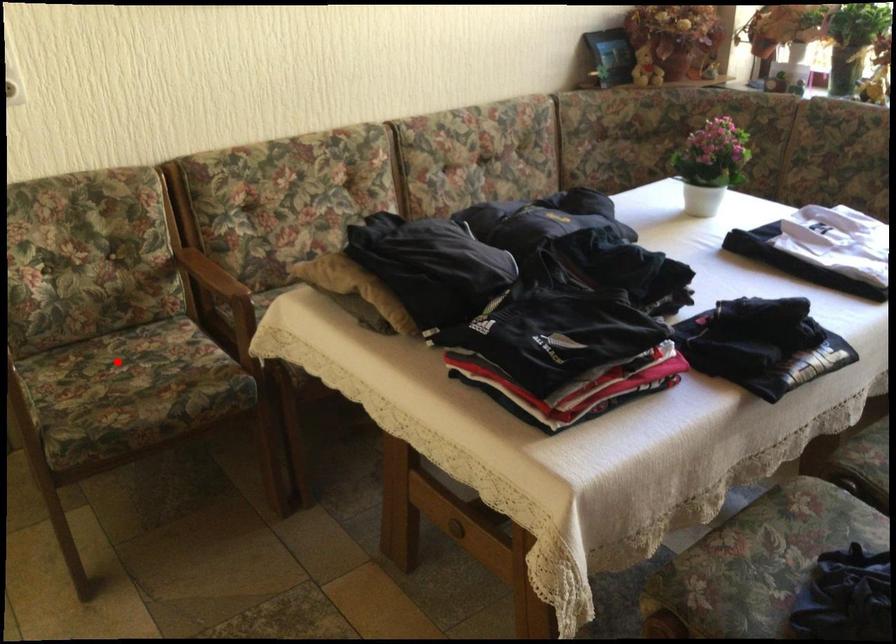
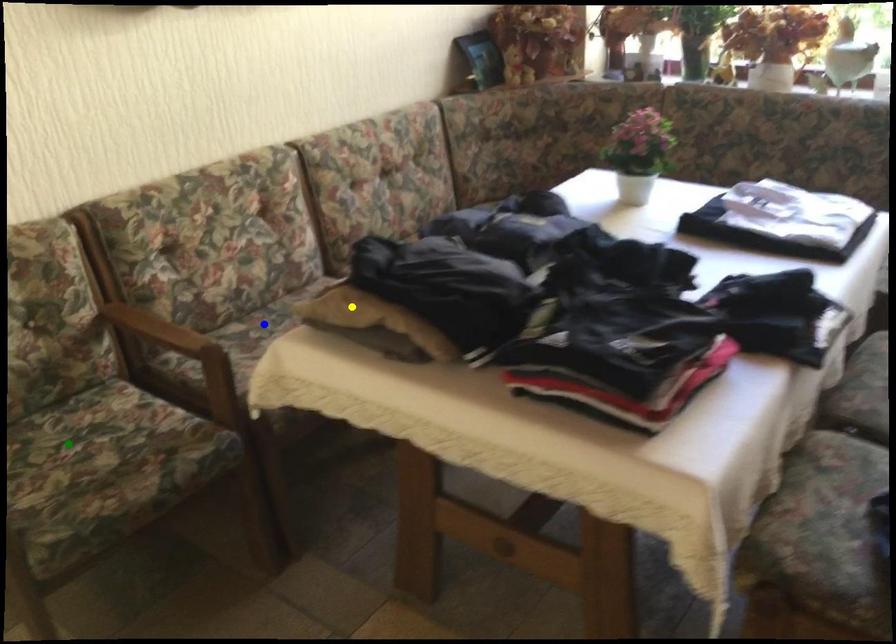
Question: I am providing you with two images of the same scene from different viewpoints. A red point is marked on the first image. You are given multiple points on the second image. Which spot in image 2 lines up with the point in image 1?

Choices:
 (A) yellow point
 (B) green point
 (C) blue point

Answer: (B)